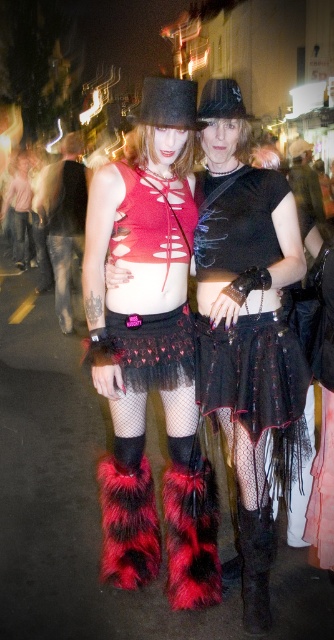
Question: Does fuzzy fur boots at lower center appear over black sequined skirt at center?

Choices:
 (A) no
 (B) yes

Answer: (A)

Question: Does black sequined skirt at center have a lesser width compared to black mesh skirt at center?

Choices:
 (A) no
 (B) yes

Answer: (A)

Question: Which object is the closest to the fuzzy fur boots at lower center?

Choices:
 (A) black suede boot at lower center
 (B) black mesh skirt at center
 (C) black sequined skirt at center

Answer: (B)

Question: Which point appears farthest from the camera in this image?

Choices:
 (A) tap(192, 332)
 (B) tap(96, 284)
 (C) tap(256, 573)
 (D) tap(303, 266)

Answer: (A)

Question: Which point appears closest to the camera in this image?

Choices:
 (A) (211, 396)
 (B) (190, 547)

Answer: (A)

Question: Does black sequined skirt at center appear on the left side of black mesh skirt at center?

Choices:
 (A) no
 (B) yes

Answer: (A)